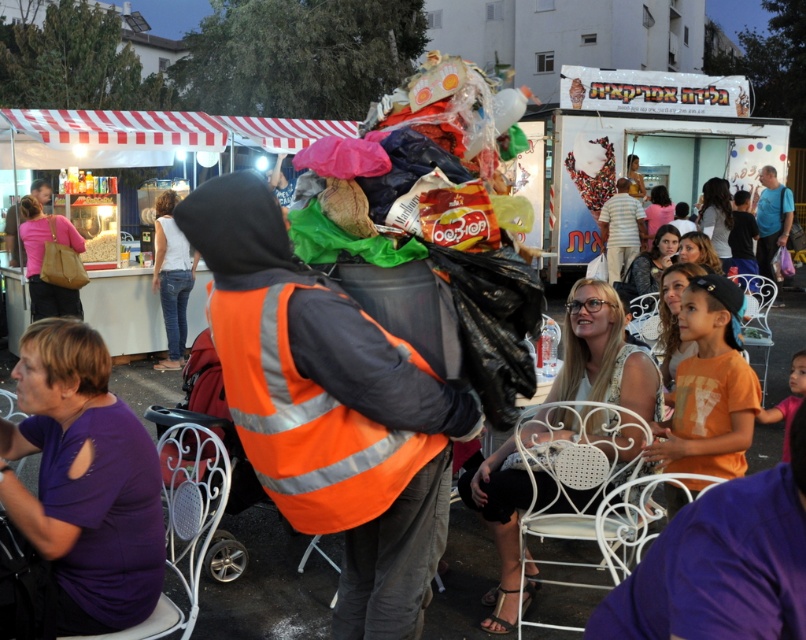
Question: From the image, what is the correct spatial relationship of striped cotton shirt at center in relation to blue t-shirt at center?

Choices:
 (A) left
 (B) right

Answer: (A)

Question: Which of the following is the closest to the observer?

Choices:
 (A) orange reflective vest at center
 (B) white cardboard food truck at center
 (C) blue t-shirt at center
 (D) striped cotton shirt at center

Answer: (A)

Question: Which object is the farthest from the striped cotton shirt at center?

Choices:
 (A) orange reflective vest at center
 (B) blue t-shirt at center

Answer: (A)

Question: Is orange reflective vest at center bigger than blue t-shirt at center?

Choices:
 (A) no
 (B) yes

Answer: (A)

Question: Which object appears closest to the camera in this image?

Choices:
 (A) striped cotton shirt at center
 (B) blue t-shirt at center

Answer: (A)

Question: Is orange reflective vest at center wider than white cardboard food truck at center?

Choices:
 (A) yes
 (B) no

Answer: (B)